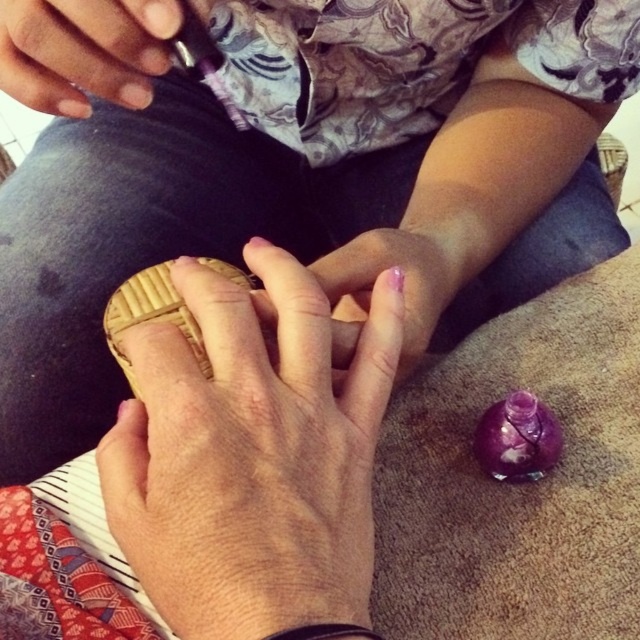
Question: Can you confirm if smooth skin hand at center is smaller than pink polished nails at center?

Choices:
 (A) yes
 (B) no

Answer: (B)

Question: Which object appears closest to the camera in this image?

Choices:
 (A) wooden sandal at center
 (B) metallic ring at upper left
 (C) pink polished nails at center
 (D) smooth skin hand at center

Answer: (D)

Question: Is smooth skin hand at center wider than metallic ring at upper left?

Choices:
 (A) yes
 (B) no

Answer: (A)

Question: Which point is farther from the camera taking this photo?

Choices:
 (A) (352, 349)
 (B) (129, 10)

Answer: (A)

Question: Does smooth skin hand at center come in front of wooden sandal at center?

Choices:
 (A) no
 (B) yes

Answer: (B)

Question: Which of these objects is positioned closest to the smooth skin hand at center?

Choices:
 (A) pink polished nails at center
 (B) metallic ring at upper left

Answer: (A)